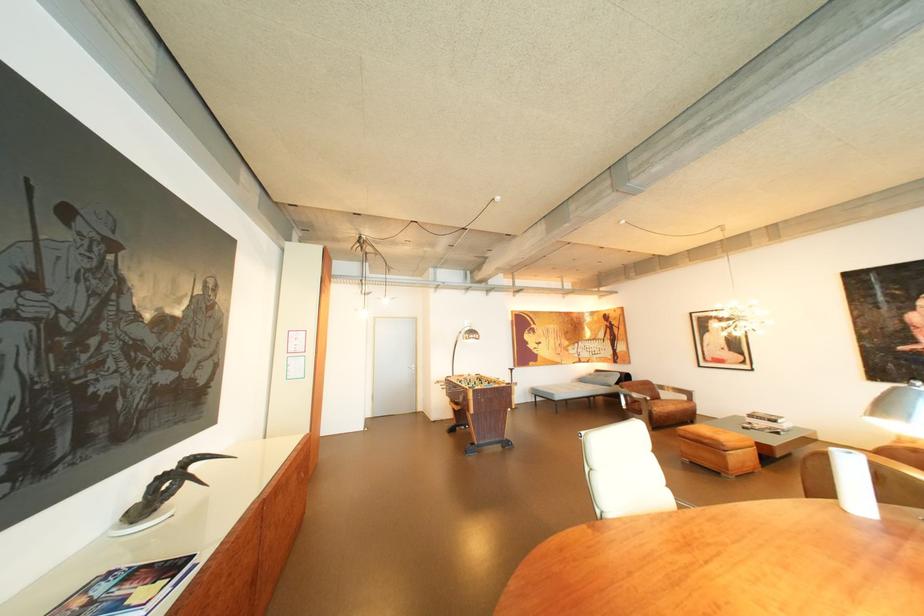
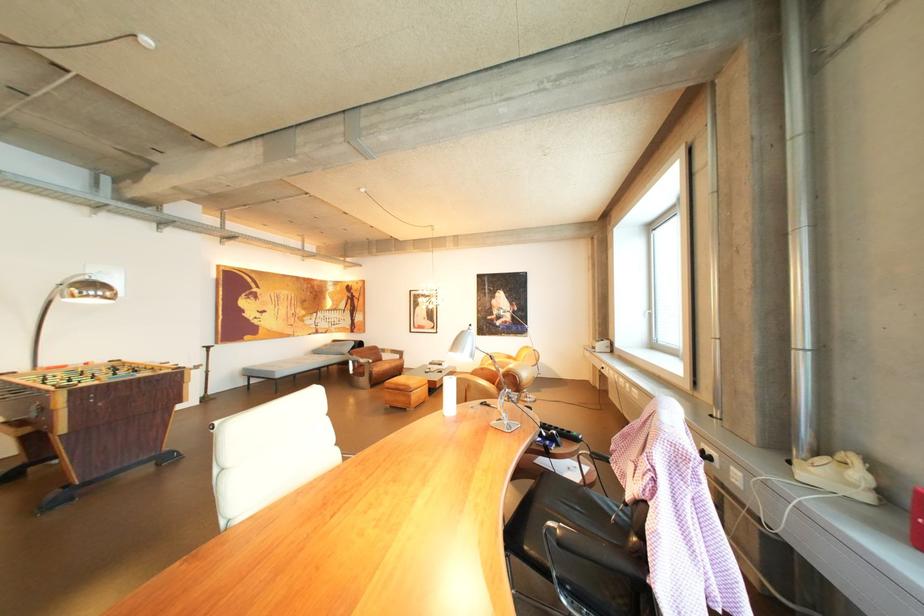
Locate, in the second image, the point that corresponds to pixel 565 395 in the first image.

(286, 373)